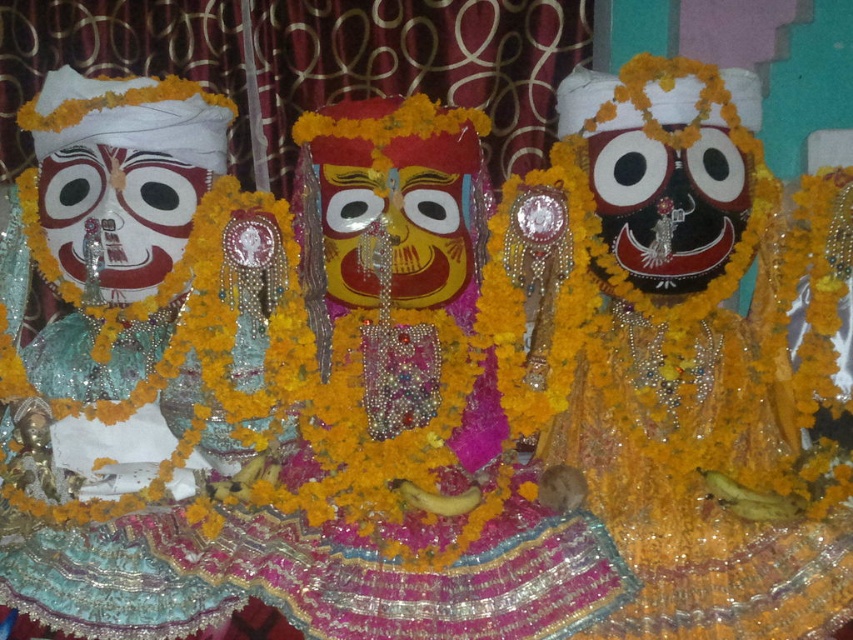
In the traditional Indian religious scene, there are two important items displayed on the platform. The shiny gold ornament at center and the matte white mask at left. Which of these two items is larger in size?

The shiny gold ornament at center is bigger than matte white mask at left.

You are an art restorer examining the traditional Indian religious scene. You notice two items on the left side of the platform. Which one is nearer to you, the matte green statue at left or the matte white mask at left?

The matte green statue at left is closer to the viewer than the matte white mask at left, so the matte green statue at left is nearer to you.

In the traditional Indian religious scene, where exactly is the yellow matte mask at center located in terms of coordinates?

The yellow matte mask at center is located at point coordinates of 0.367 on the x axis and 0.465 on the y axis.